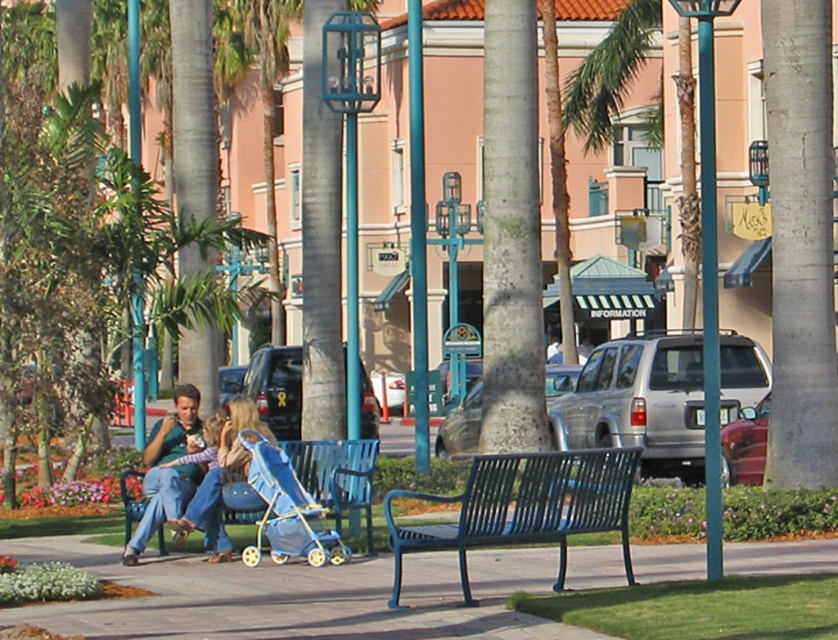
Question: Is blue plastic bench at center above denim jeans at center?

Choices:
 (A) yes
 (B) no

Answer: (B)

Question: Which object is the farthest from the blue metal bench at center?

Choices:
 (A) matte blue jeans at center
 (B) matte blue stroller at center
 (C) smooth concrete pavement at center

Answer: (A)

Question: Which point is farther to the camera?

Choices:
 (A) blue metal bench at center
 (B) blue plastic bench at center
 (C) matte blue stroller at center
 (D) denim jeans at center

Answer: (B)

Question: Does blue metal bench at center have a smaller size compared to denim jeans at center?

Choices:
 (A) yes
 (B) no

Answer: (B)

Question: Is blue metal bench at center below matte blue stroller at center?

Choices:
 (A) yes
 (B) no

Answer: (B)

Question: Which object is the closest to the smooth concrete pavement at center?

Choices:
 (A) matte blue jeans at center
 (B) blue plastic bench at center
 (C) matte blue stroller at center
 (D) blue metal bench at center

Answer: (A)